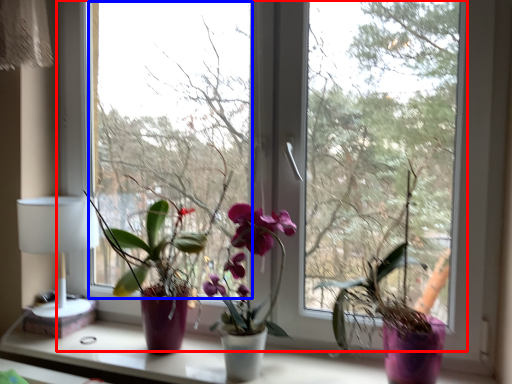
Question: Among these objects, which one is farthest to the camera, window (highlighted by a red box) or window screen (highlighted by a blue box)?

Choices:
 (A) window
 (B) window screen

Answer: (B)